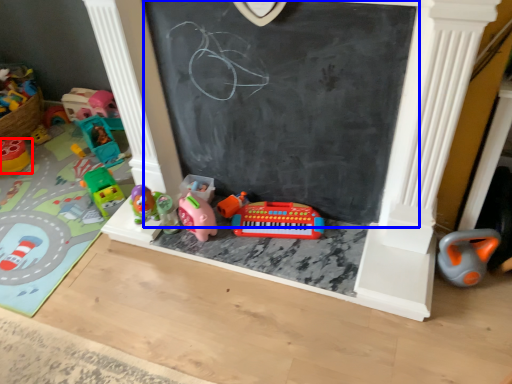
Question: Among these objects, which one is nearest to the camera, toy (highlighted by a red box) or bulletin board (highlighted by a blue box)?

Choices:
 (A) toy
 (B) bulletin board

Answer: (B)